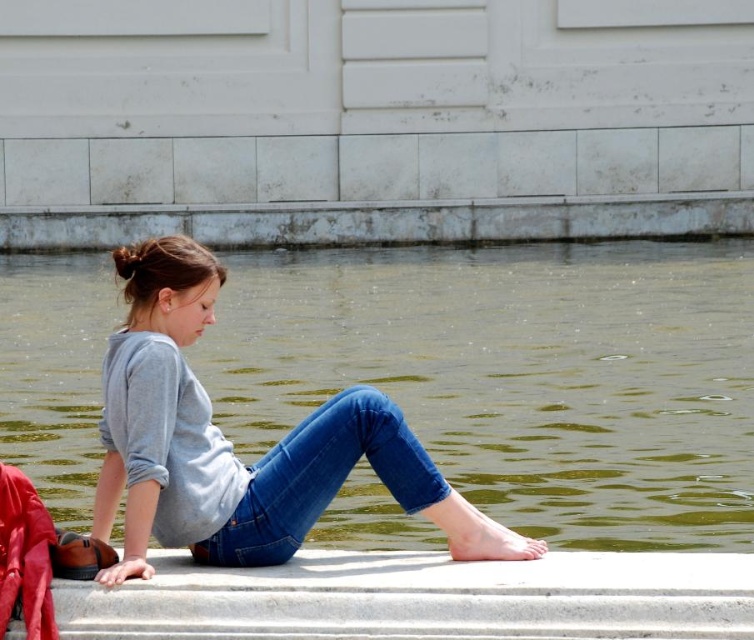
Does gray cotton shirt at center appear on the left side of blue denim jeans at lower center?

In fact, gray cotton shirt at center is to the right of blue denim jeans at lower center.

Is point (167, 541) more distant than point (287, 470)?

Yes, point (167, 541) is behind point (287, 470).

This screenshot has height=640, width=754. Describe the element at coordinates (231, 448) in the screenshot. I see `gray cotton shirt at center` at that location.

This screenshot has width=754, height=640. I want to click on gray cotton shirt at center, so click(231, 448).

Does gray concrete curb at upper center have a smaller size compared to blue denim jeans at lower center?

Actually, gray concrete curb at upper center might be larger than blue denim jeans at lower center.

The width and height of the screenshot is (754, 640). What are the coordinates of `gray concrete curb at upper center` in the screenshot? It's located at (382, 221).

Does point (121, 413) come behind point (645, 220)?

No, it is not.

Between gray cotton shirt at center and gray concrete curb at upper center, which one has more height?

gray concrete curb at upper center is taller.

Consider the image. Who is more forward, (100, 428) or (507, 211)?

Positioned in front is point (100, 428).

Locate an element on the screen. The image size is (754, 640). gray cotton shirt at center is located at coordinates (231, 448).